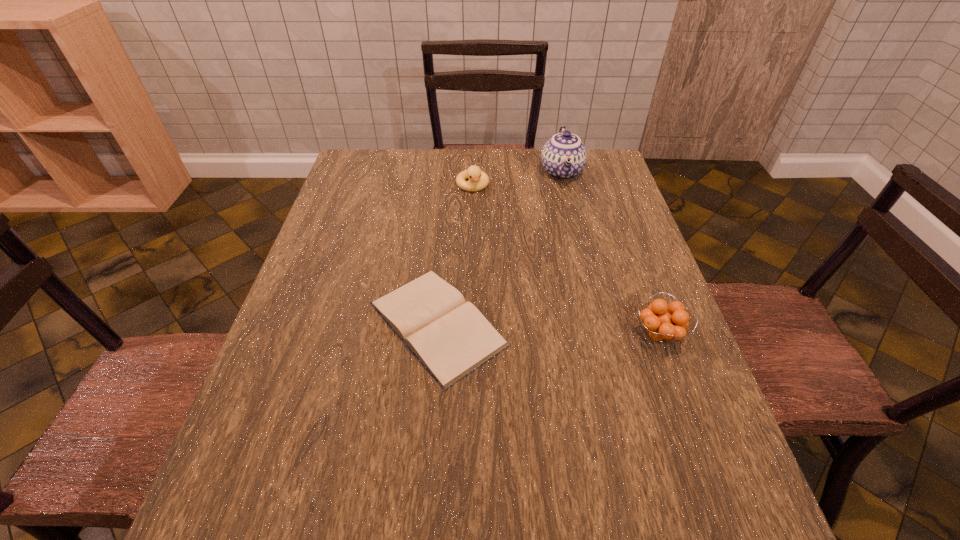
The image size is (960, 540). I want to click on vacant spot on the desktop that is between the Bible and the orange fruit and is positioned at the beak of the duckling, so click(x=516, y=327).

Where is `vacant space on the desktop that is between the Bible and the orange fruit and is positioned from the spout of the tallest object`? This screenshot has height=540, width=960. vacant space on the desktop that is between the Bible and the orange fruit and is positioned from the spout of the tallest object is located at coordinates (575, 330).